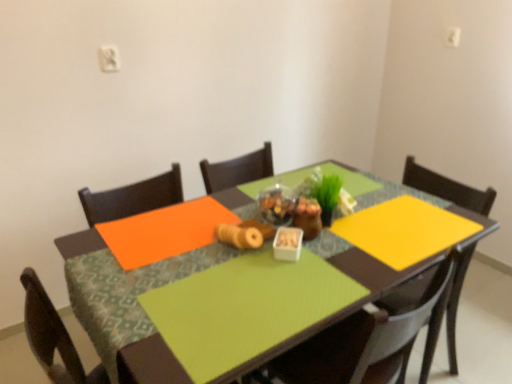
Where is `free space above green fabric table at center (from a real-world perspective)`? free space above green fabric table at center (from a real-world perspective) is located at coordinates (270, 245).